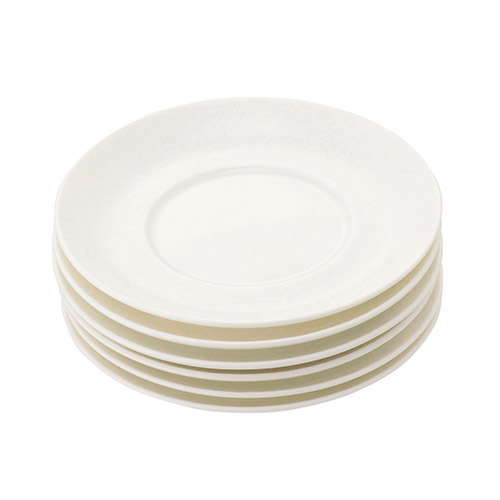
This screenshot has height=500, width=500. What are the coordinates of `plates` in the screenshot? It's located at (236, 323), (237, 344), (237, 363), (237, 377), (237, 393), (237, 407).